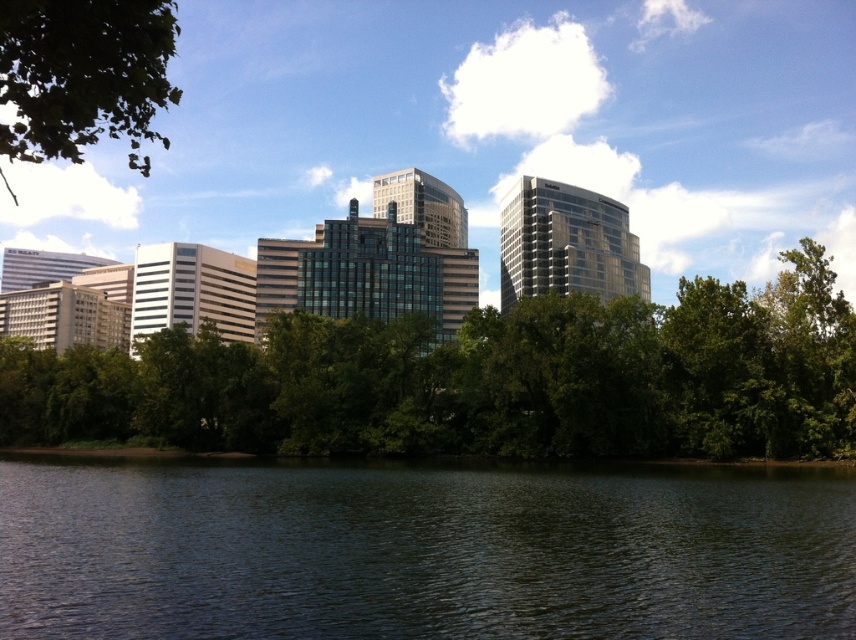
You are standing at the edge of the water in the image. If you want to reach the green leafy trees at center, in which direction should you walk? Please provide your answer in terms of compass directions like north, south, east, west, northeast, etc.

The green leafy trees at center are located at point coordinates of [479,380]. Since you are at the edge of the water in the foreground, you would need to walk towards the north direction to reach them.

You are standing at the edge of the water and want to take a photo of the green leafy trees at center while avoiding the dark green water at lower center. Which direction should you move to ensure the trees are in the frame without the water?

You should move to the left because the dark green water at lower center is to the right of the green leafy trees at center. Moving left will position you away from the water, keeping the trees in view without the water obstructing the shot.